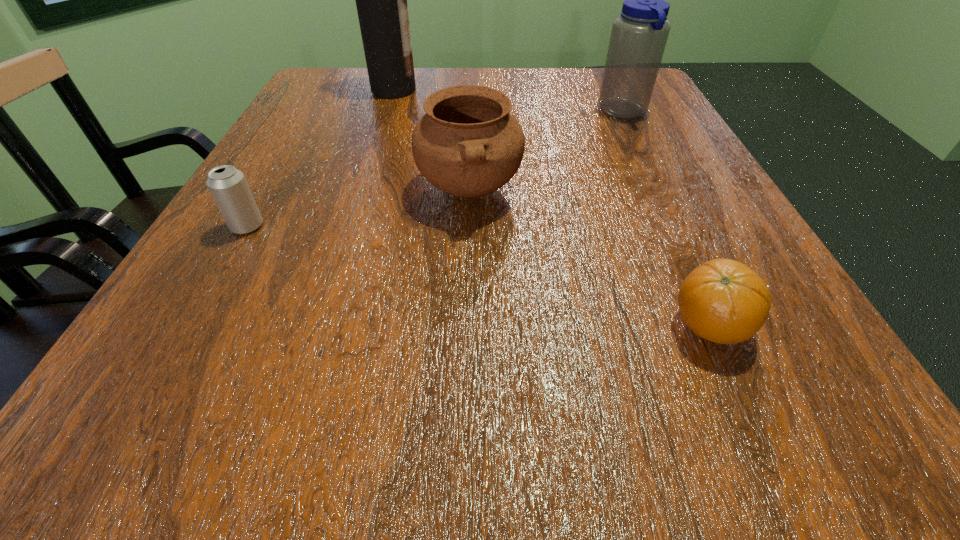
Identify the location of free space that satisfies the following two spatial constraints: 1. on the back side of the third tallest object; 2. on the left side of the leftmost object. (268, 190).